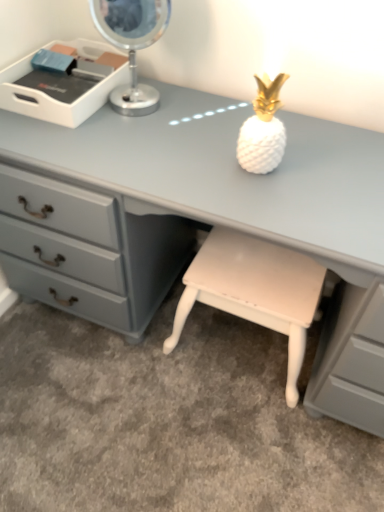
The width and height of the screenshot is (384, 512). I want to click on free spot in front of white glossy stool at lower center, so click(x=238, y=443).